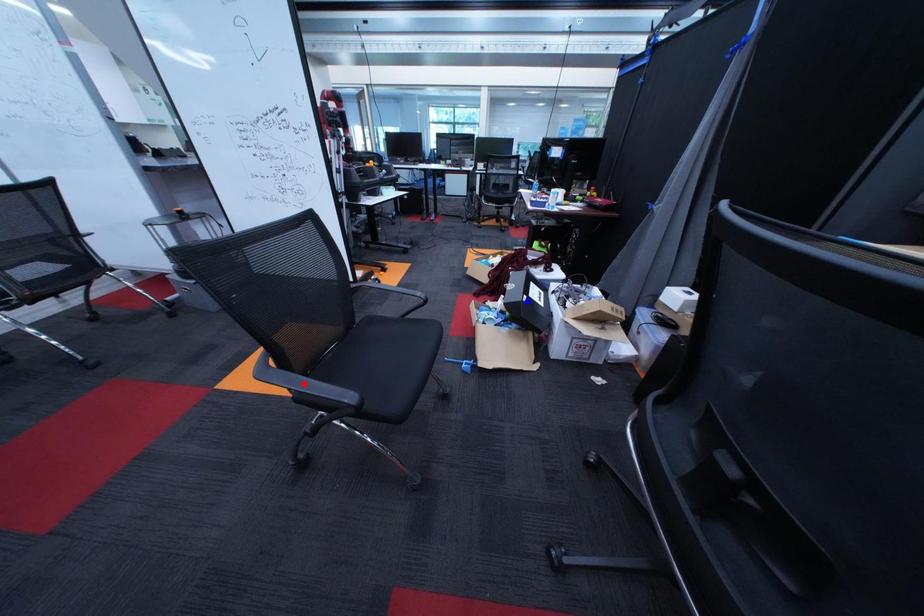
Question: Two points are marked on the image. Which point is closer to the camera?

Choices:
 (A) Blue point is closer.
 (B) Red point is closer.

Answer: (B)